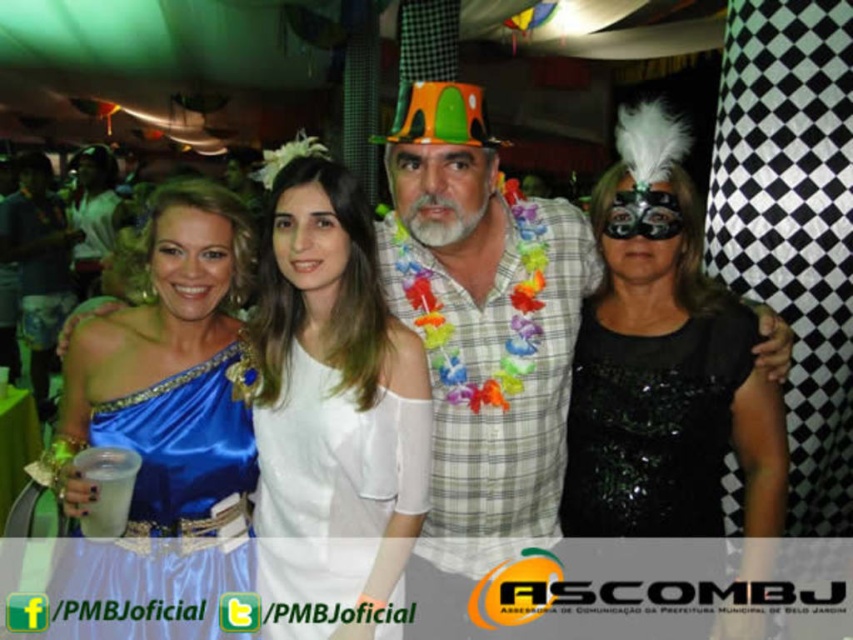
Question: Observing the image, what is the correct spatial positioning of satin blue dress at center in reference to blue satin dress at left?

Choices:
 (A) below
 (B) above

Answer: (B)

Question: Among these objects, which one is farthest from the camera?

Choices:
 (A) black sequined dress at right
 (B) black sequined mask at right
 (C) blue satin dress at left

Answer: (A)

Question: Among these objects, which one is nearest to the camera?

Choices:
 (A) white sheer dress at center
 (B) black sequined dress at right
 (C) blue satin dress at left
 (D) black sequined mask at right

Answer: (A)

Question: From the image, what is the correct spatial relationship of black sequined mask at right in relation to black sequined dress at right?

Choices:
 (A) above
 (B) below

Answer: (A)

Question: Is the position of satin blue dress at center more distant than that of blue satin dress at left?

Choices:
 (A) yes
 (B) no

Answer: (B)

Question: Among these objects, which one is farthest from the camera?

Choices:
 (A) black sequined dress at right
 (B) satin blue dress at center

Answer: (A)